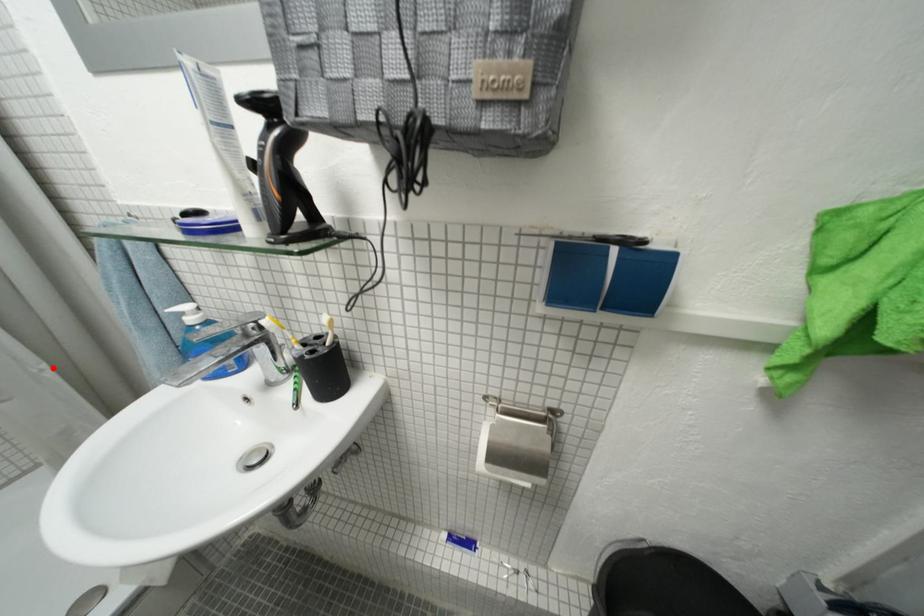
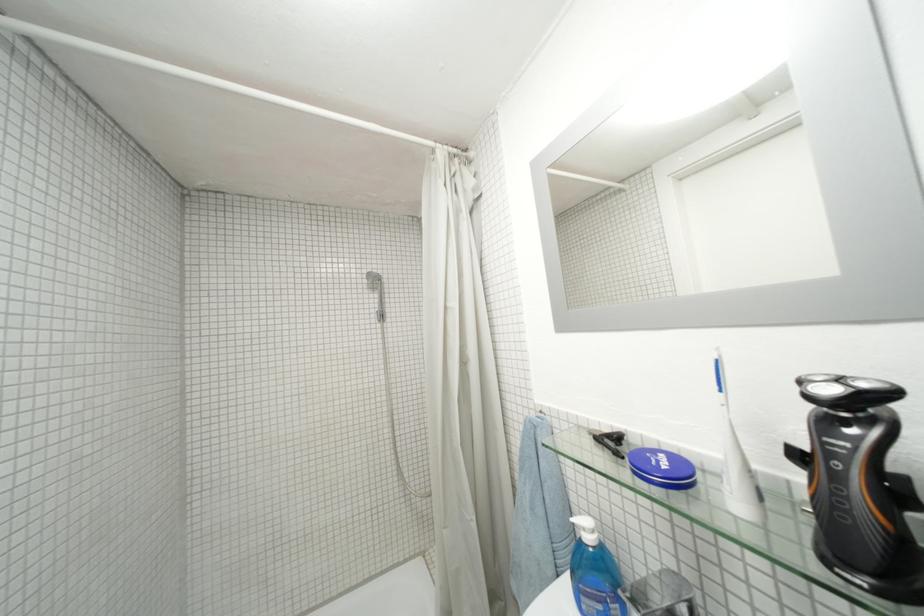
Find the pixel in the second image that matches the highlighted location in the first image.

(482, 521)